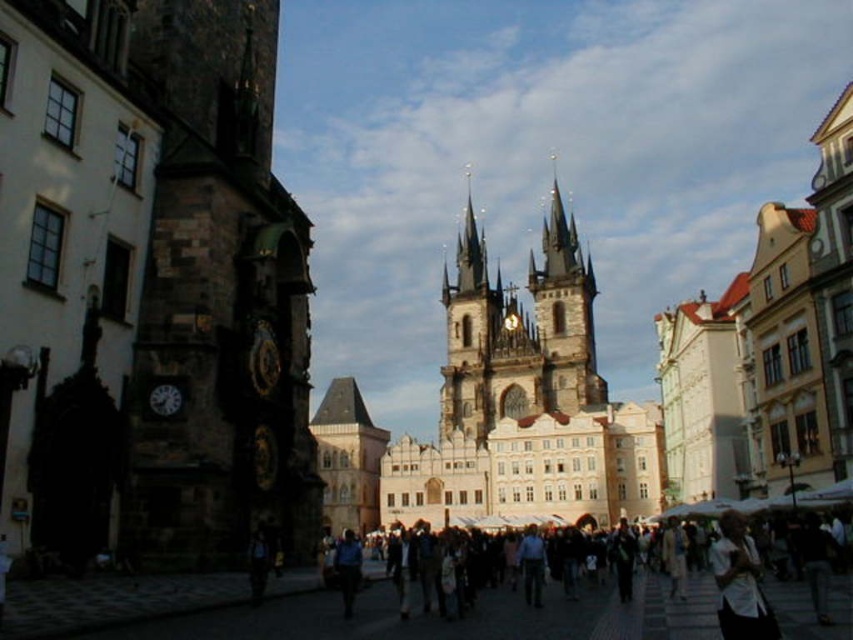
Question: Which is nearer to the blue fabric shirt at center?

Choices:
 (A) white matte shirt at lower right
 (B) dark clothing crowd at center

Answer: (B)

Question: Can you confirm if brown stone church at center is thinner than blue fabric shirt at center?

Choices:
 (A) yes
 (B) no

Answer: (B)

Question: Does dark clothing crowd at center have a smaller size compared to blue fabric shirt at center?

Choices:
 (A) no
 (B) yes

Answer: (B)

Question: Can you confirm if white matte shirt at lower right is wider than blue fabric shirt at center?

Choices:
 (A) yes
 (B) no

Answer: (B)

Question: Estimate the real-world distances between objects in this image. Which object is closer to the blue fabric shirt at center?

Choices:
 (A) brown stone church at center
 (B) white matte shirt at lower right
 (C) dark clothing crowd at center

Answer: (C)

Question: Which object is positioned farthest from the brown stone church at center?

Choices:
 (A) blue fabric shirt at center
 (B) white matte shirt at lower right

Answer: (B)